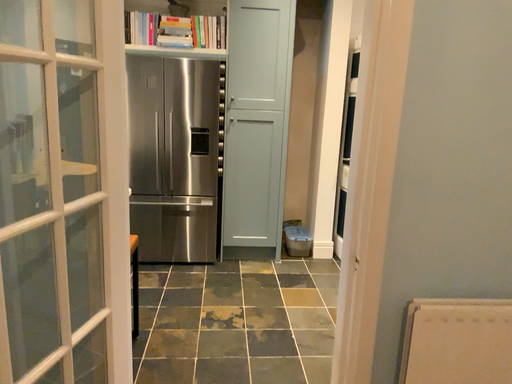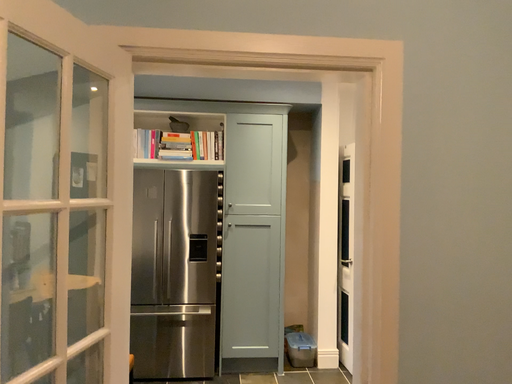
Question: Which way did the camera rotate in the video?

Choices:
 (A) rotated downward
 (B) rotated upward

Answer: (B)